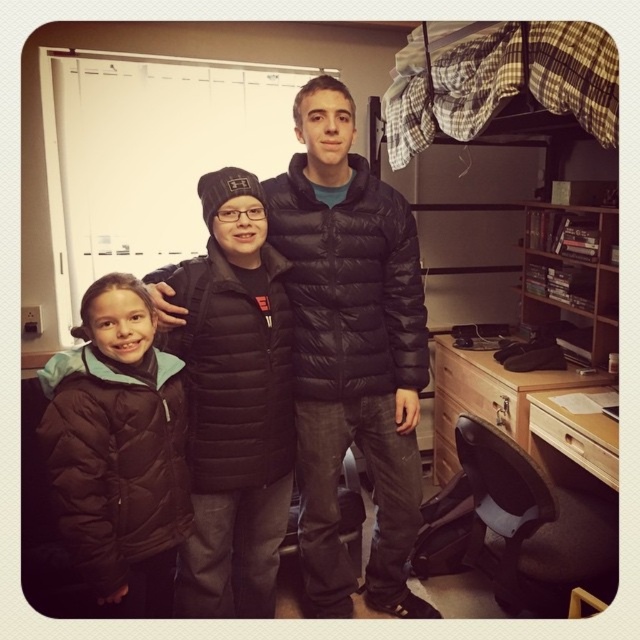
You are organizing a clothing donation drive and need to determine which of the two jackets at the center of the image is bigger. The jackets are labeled as the black puffer jacket at center and the matte black jacket at center. Based on the image, which one is larger?

The black puffer jacket at center is larger than the matte black jacket at center.

You are trying to decide which jacket to take for a cold day. You have the matte black jacket at center and the brown puffy jacket at left. Which one is bigger?

The matte black jacket at center is larger in size compared to the brown puffy jacket at left, so you should choose the matte black jacket at center for a cold day.

You are planning to place a small plant pot on the desk in the dorm room scene. The plant pot has a diameter of 15 cm. The desk has a total area of 1.2 square meters. The coordinates of the matte black jacket at center are at point 0.627, 0.364. Is there enough space on the desk to place the plant pot without overlapping any existing items?

The desk has a total area of 1.2 square meters, and the plant pot has a diameter of 15 cm. Since the coordinates of the matte black jacket at center are at point (232, 401), there should be enough space on the desk to place the plant pot without overlapping any existing items, provided the items are not densely packed.